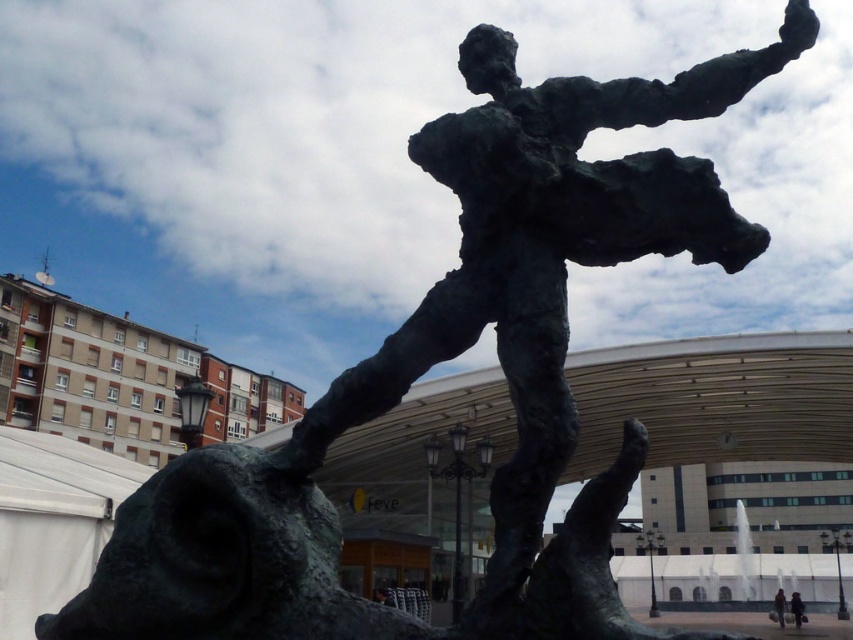
Is dark brown leather jacket at lower right closer to camera compared to dark gray fabric bag at lower right?

No, it is behind dark gray fabric bag at lower right.

Who is higher up, dark brown leather jacket at lower right or dark gray fabric bag at lower right?

dark brown leather jacket at lower right is higher up.

At what (x,y) coordinates should I click in order to perform the action: click on dark brown leather jacket at lower right. Please return your answer as a coordinate pair (x, y). The width and height of the screenshot is (853, 640). Looking at the image, I should click on (798, 609).